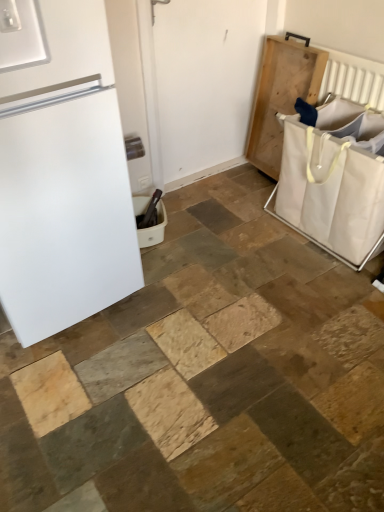
Find the location of a particular element. The image size is (384, 512). white matte refrigerator at left is located at coordinates (64, 178).

Locate an element on the screen. laundry basket that is the 2nd object directly below the white matte refrigerator at left (from a real-world perspective) is located at coordinates (154, 229).

Which is less distant, (164, 226) or (52, 293)?

Point (52, 293)

From the image's perspective, is white plastic laundry basket at lower center, placed as the 1th laundry basket when sorted from left to right, positioned above or below white matte refrigerator at left?

Based on their image positions, white plastic laundry basket at lower center, placed as the 1th laundry basket when sorted from left to right, is located beneath white matte refrigerator at left.

Considering the relative sizes of white plastic laundry basket at lower center, placed as the 1th laundry basket when sorted from left to right, and white matte refrigerator at left in the image provided, is white plastic laundry basket at lower center, placed as the 1th laundry basket when sorted from left to right, smaller than white matte refrigerator at left?

Yes, white plastic laundry basket at lower center, placed as the 1th laundry basket when sorted from left to right, is smaller than white matte refrigerator at left.

The height and width of the screenshot is (512, 384). Identify the location of refrigerator on the left of white canvas laundry basket at right, which ranks as the 1th laundry basket in right-to-left order. (64, 178).

Can you confirm if white matte refrigerator at left is smaller than white canvas laundry basket at right, which ranks as the 1th laundry basket in right-to-left order?

Actually, white matte refrigerator at left might be larger than white canvas laundry basket at right, which ranks as the 1th laundry basket in right-to-left order.

Based on the photo, is white matte refrigerator at left directly adjacent to white canvas laundry basket at right, arranged as the second laundry basket when viewed from the left?

There is a gap between white matte refrigerator at left and white canvas laundry basket at right, arranged as the second laundry basket when viewed from the left.

Between white matte refrigerator at left and white canvas laundry basket at right, arranged as the second laundry basket when viewed from the left, which one has more height?

With more height is white matte refrigerator at left.

Which object is thinner, natural wood tray at right or white matte refrigerator at left?

With smaller width is natural wood tray at right.

Is natural wood tray at right positioned with its back to white matte refrigerator at left?

That's not correct — natural wood tray at right is not looking away from white matte refrigerator at left.

From a real-world perspective, is natural wood tray at right on top of white matte refrigerator at left?

Actually, natural wood tray at right is physically below white matte refrigerator at left in the real world.

From the image's perspective, which one is positioned higher, natural wood tray at right or white matte refrigerator at left?

natural wood tray at right appears higher in the image.

Consider the image. Is natural wood tray at right touching white canvas laundry basket at right, arranged as the second laundry basket when viewed from the left?

natural wood tray at right is not next to white canvas laundry basket at right, arranged as the second laundry basket when viewed from the left, and they're not touching.

Would you say natural wood tray at right contains white canvas laundry basket at right, arranged as the second laundry basket when viewed from the left?

No, white canvas laundry basket at right, arranged as the second laundry basket when viewed from the left, is not a part of natural wood tray at right.

Which is less distant, (263, 164) or (365, 211)?

The point (365, 211) is closer to the camera.

Between natural wood tray at right and white canvas laundry basket at right, which ranks as the 1th laundry basket in right-to-left order, which one has larger width?

white canvas laundry basket at right, which ranks as the 1th laundry basket in right-to-left order.

Could you measure the distance between white plastic laundry basket at lower center, marked as the 2th laundry basket in a right-to-left arrangement, and white matte screen door at center?

A distance of 70.54 centimeters exists between white plastic laundry basket at lower center, marked as the 2th laundry basket in a right-to-left arrangement, and white matte screen door at center.

Who is smaller, white plastic laundry basket at lower center, placed as the 1th laundry basket when sorted from left to right, or white matte screen door at center?

white plastic laundry basket at lower center, placed as the 1th laundry basket when sorted from left to right.

Which point is more forward, (156,206) or (180,160)?

The point (156,206) is more forward.

Is white plastic laundry basket at lower center, placed as the 1th laundry basket when sorted from left to right, aimed at white matte screen door at center?

No, white plastic laundry basket at lower center, placed as the 1th laundry basket when sorted from left to right, is not facing towards white matte screen door at center.

This screenshot has height=512, width=384. Find the location of `screen door on the right of the white plastic laundry basket at lower center, placed as the 1th laundry basket when sorted from left to right`. screen door on the right of the white plastic laundry basket at lower center, placed as the 1th laundry basket when sorted from left to right is located at coordinates coord(205,79).

Which point is more forward, (171,139) or (147,233)?

The point (147,233) is in front.

Could you tell me if white matte screen door at center is turned towards white plastic laundry basket at lower center, marked as the 2th laundry basket in a right-to-left arrangement?

No.

From a real-world perspective, does white matte screen door at center stand above white plastic laundry basket at lower center, marked as the 2th laundry basket in a right-to-left arrangement?

Yes, from a real-world perspective, white matte screen door at center is above white plastic laundry basket at lower center, marked as the 2th laundry basket in a right-to-left arrangement.

Can you confirm if white matte refrigerator at left is smaller than natural wood tray at right?

Actually, white matte refrigerator at left might be larger than natural wood tray at right.

Can you confirm if white matte refrigerator at left is positioned to the right of natural wood tray at right?

Answer: Incorrect, white matte refrigerator at left is not on the right side of natural wood tray at right.

Is white matte refrigerator at left taller or shorter than natural wood tray at right?

white matte refrigerator at left is taller than natural wood tray at right.

Find the location of a particular element. This screenshot has height=512, width=384. changing table that appears below the white matte refrigerator at left (from a real-world perspective) is located at coordinates (281, 96).

Starting from the white matte refrigerator at left, which laundry basket is the 1st one to the right? Please provide its 2D coordinates.

[(154, 229)]

I want to click on refrigerator in front of the white canvas laundry basket at right, which ranks as the 1th laundry basket in right-to-left order, so click(x=64, y=178).

Looking at the image, which one is located closer to natural wood tray at right, white matte refrigerator at left or white plastic laundry basket at lower center, marked as the 2th laundry basket in a right-to-left arrangement?

Based on the image, white plastic laundry basket at lower center, marked as the 2th laundry basket in a right-to-left arrangement, appears to be nearer to natural wood tray at right.

When comparing their distances from natural wood tray at right, does white matte refrigerator at left or white canvas laundry basket at right, arranged as the second laundry basket when viewed from the left, seem closer?

Based on the image, white canvas laundry basket at right, arranged as the second laundry basket when viewed from the left, appears to be nearer to natural wood tray at right.

Considering their positions, is white canvas laundry basket at right, which ranks as the 1th laundry basket in right-to-left order, positioned closer to white plastic laundry basket at lower center, marked as the 2th laundry basket in a right-to-left arrangement, than white matte refrigerator at left?

The object closer to white plastic laundry basket at lower center, marked as the 2th laundry basket in a right-to-left arrangement, is white matte refrigerator at left.

Which object lies further to the anchor point natural wood tray at right, white matte screen door at center or white matte refrigerator at left?

The object further to natural wood tray at right is white matte refrigerator at left.

From the image, which object appears to be farther from white matte refrigerator at left, white matte screen door at center or natural wood tray at right?

natural wood tray at right.

From the image, which object appears to be farther from white plastic laundry basket at lower center, placed as the 1th laundry basket when sorted from left to right, white canvas laundry basket at right, arranged as the second laundry basket when viewed from the left, or natural wood tray at right?

natural wood tray at right.

Considering their positions, is white matte screen door at center positioned closer to white matte refrigerator at left than white plastic laundry basket at lower center, marked as the 2th laundry basket in a right-to-left arrangement?

white plastic laundry basket at lower center, marked as the 2th laundry basket in a right-to-left arrangement, lies closer to white matte refrigerator at left than the other object.

From the image, which object appears to be nearer to white matte screen door at center, natural wood tray at right or white matte refrigerator at left?

natural wood tray at right is positioned closer to the anchor white matte screen door at center.

Locate an element on the screen. The image size is (384, 512). changing table between white plastic laundry basket at lower center, marked as the 2th laundry basket in a right-to-left arrangement, and white canvas laundry basket at right, which ranks as the 1th laundry basket in right-to-left order, from left to right is located at coordinates (281, 96).

Where is `changing table between white matte refrigerator at left and white plastic laundry basket at lower center, placed as the 1th laundry basket when sorted from left to right, from front to back`? The height and width of the screenshot is (512, 384). changing table between white matte refrigerator at left and white plastic laundry basket at lower center, placed as the 1th laundry basket when sorted from left to right, from front to back is located at coordinates (281, 96).

You are a GUI agent. You are given a task and a screenshot of the screen. Output one action in this format:
    pyautogui.click(x=<x>, y=<y>)
    Task: Click on the changing table between white matte screen door at center and white canvas laundry basket at right, arranged as the second laundry basket when viewed from the left, from left to right
    This screenshot has width=384, height=512.
    Given the screenshot: What is the action you would take?
    pyautogui.click(x=281, y=96)

Find the location of a particular element. changing table between white matte screen door at center and white plastic laundry basket at lower center, placed as the 1th laundry basket when sorted from left to right, in the up-down direction is located at coordinates (281, 96).